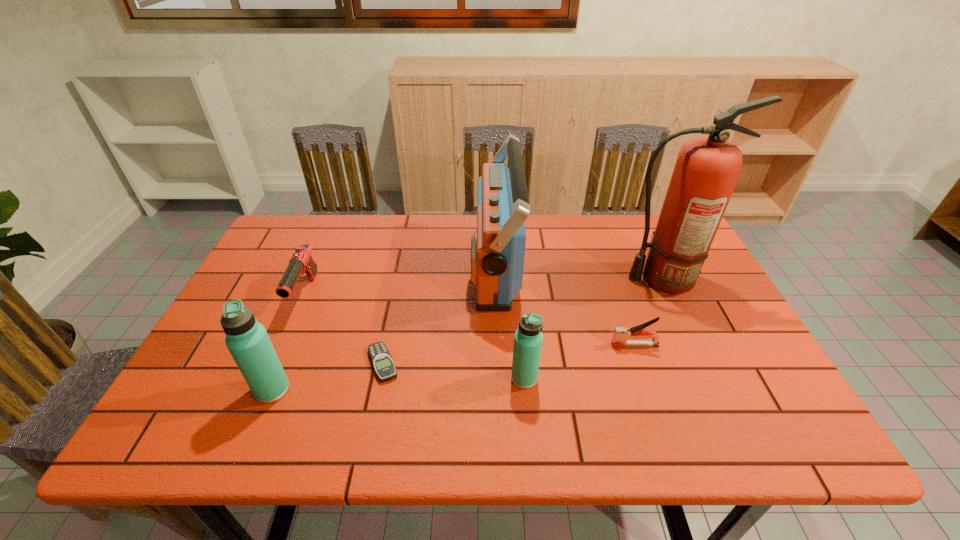
In order to click on free point located on the nozzle of the tallest object in this screenshot , I will do `click(538, 279)`.

I want to click on vacant space located on the back of the beeper, so click(398, 289).

Where is `vacant position located at the aiming end of the gun`? The height and width of the screenshot is (540, 960). vacant position located at the aiming end of the gun is located at coordinates (276, 362).

Image resolution: width=960 pixels, height=540 pixels. Find the location of `object that is at the far edge`. object that is at the far edge is located at coordinates (498, 246).

Identify the location of beeper that is positioned at the near edge. Image resolution: width=960 pixels, height=540 pixels. (381, 359).

Where is `thermos bottle that is at the left edge`? The width and height of the screenshot is (960, 540). thermos bottle that is at the left edge is located at coordinates (247, 340).

In order to click on gun situated at the left edge in this screenshot , I will do `click(301, 261)`.

Locate an element on the screen. The height and width of the screenshot is (540, 960). object positioned at the right edge is located at coordinates (707, 169).

You are a GUI agent. You are given a task and a screenshot of the screen. Output one action in this format:
    pyautogui.click(x=<x>, y=<y>)
    Task: Click on the object that is positioned at the near left corner
    
    Given the screenshot: What is the action you would take?
    pyautogui.click(x=247, y=340)

Locate an element on the screen. The height and width of the screenshot is (540, 960). free region at the far edge of the desktop is located at coordinates (543, 233).